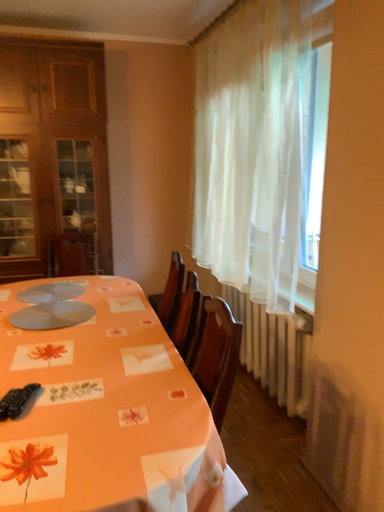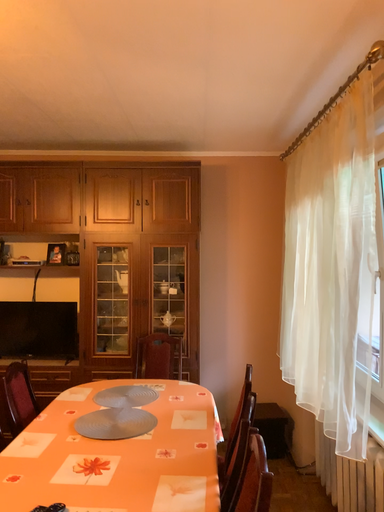
Question: Which way did the camera rotate in the video?

Choices:
 (A) rotated upward
 (B) rotated downward

Answer: (A)